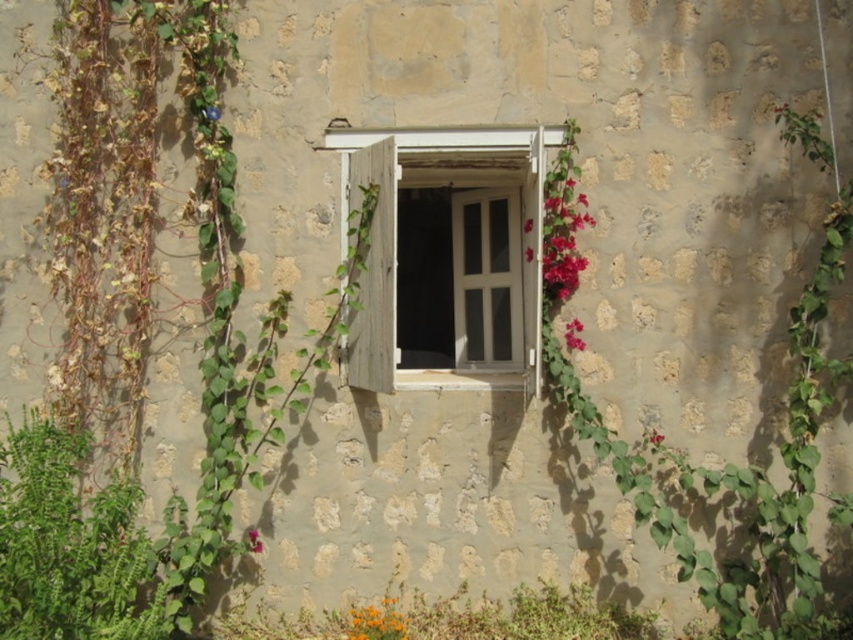
You are standing in front of the rustic stone wall and want to place a small bird feeder. The green leafy vine at right and the orange matte flower at lower center are in the way. Which object should you move to make space for the feeder?

You should move the orange matte flower at lower center because the green leafy vine at right is positioned over it, so removing the flower would allow more space below the vine.

Based on the photo, you are an interior designer assessing the rustic stone wall with an open window. You notice two flowers, an orange matte flower at lower center and a pink matte flower at lower center. Which flower is taller?

The orange matte flower at lower center is taller than the pink matte flower at lower center.